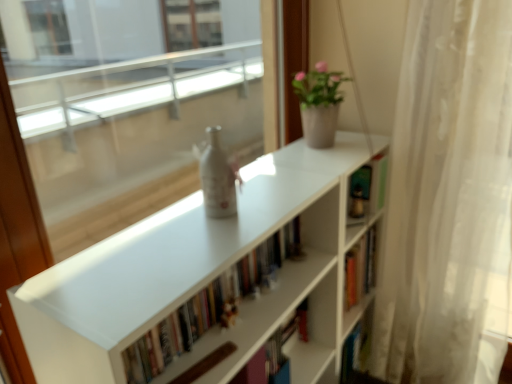
Question: Could white sheer curtain at right be considered to be inside matte white pot at upper right?

Choices:
 (A) yes
 (B) no

Answer: (B)

Question: Can you see matte white pot at upper right touching white sheer curtain at right?

Choices:
 (A) yes
 (B) no

Answer: (B)

Question: Can you confirm if matte white pot at upper right is wider than white sheer curtain at right?

Choices:
 (A) yes
 (B) no

Answer: (B)

Question: Does matte white pot at upper right turn towards white sheer curtain at right?

Choices:
 (A) yes
 (B) no

Answer: (A)

Question: Is matte white pot at upper right shorter than white sheer curtain at right?

Choices:
 (A) no
 (B) yes

Answer: (B)

Question: Is matte white pot at upper right positioned before white sheer curtain at right?

Choices:
 (A) yes
 (B) no

Answer: (B)

Question: From the image's perspective, does white matte bookcase at center appear lower than matte white pot at upper right?

Choices:
 (A) yes
 (B) no

Answer: (A)

Question: Is white matte bookcase at center to the right of matte white pot at upper right from the viewer's perspective?

Choices:
 (A) yes
 (B) no

Answer: (B)

Question: From a real-world perspective, is white matte bookcase at center on top of matte white pot at upper right?

Choices:
 (A) no
 (B) yes

Answer: (A)

Question: Is white matte bookcase at center bigger than matte white pot at upper right?

Choices:
 (A) no
 (B) yes

Answer: (B)

Question: Can we say white matte bookcase at center lies outside matte white pot at upper right?

Choices:
 (A) no
 (B) yes

Answer: (B)

Question: Is white matte bookcase at center oriented towards matte white pot at upper right?

Choices:
 (A) no
 (B) yes

Answer: (A)

Question: Is white matte bookcase at center thinner than white sheer curtain at right?

Choices:
 (A) yes
 (B) no

Answer: (B)